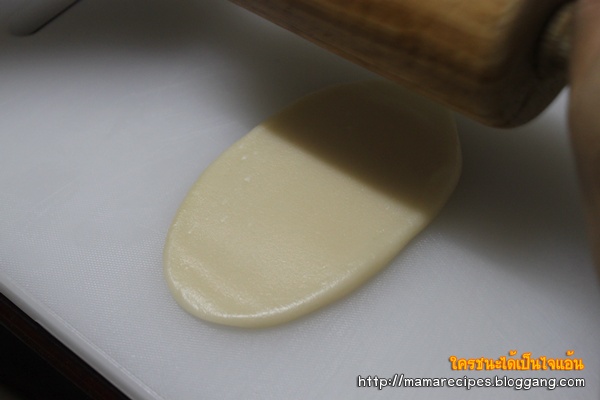
Image resolution: width=600 pixels, height=400 pixels. I want to click on counter top to left of dough, so click(x=203, y=135).